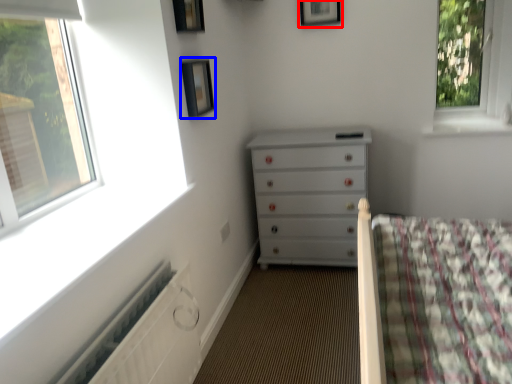
Question: Which object is further to the camera taking this photo, picture frame (highlighted by a red box) or picture frame (highlighted by a blue box)?

Choices:
 (A) picture frame
 (B) picture frame

Answer: (A)